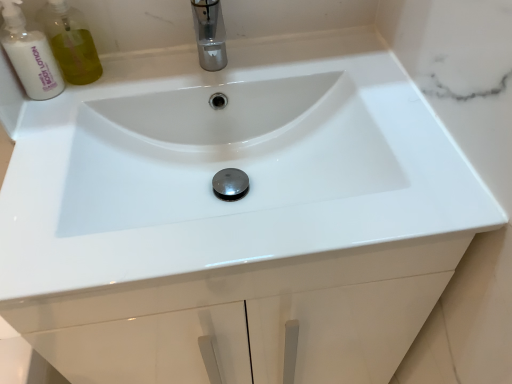
Locate an element on the screen. This screenshot has width=512, height=384. free point to the right of polished chrome tap at upper center is located at coordinates click(309, 67).